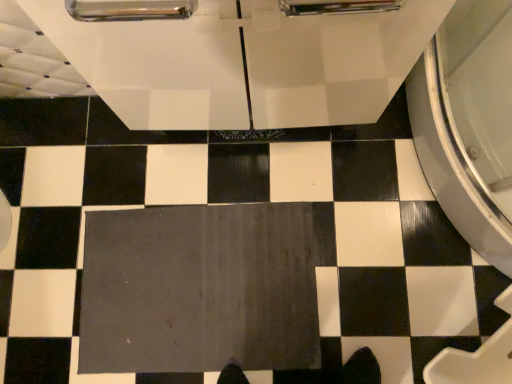
Locate an element on the screen. This screenshot has width=512, height=384. vacant space situated on the left part of dark gray rubber bath mat at center is located at coordinates (42, 278).